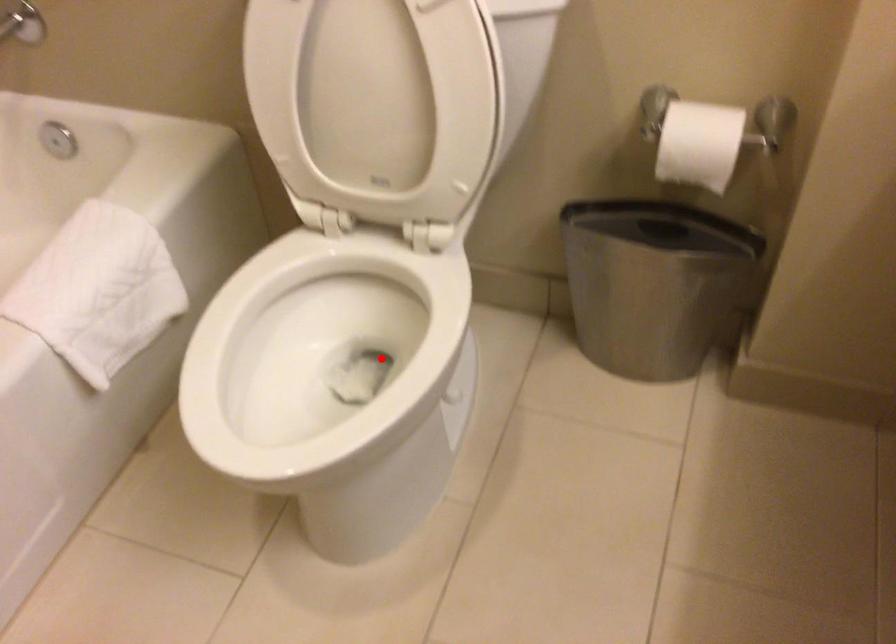
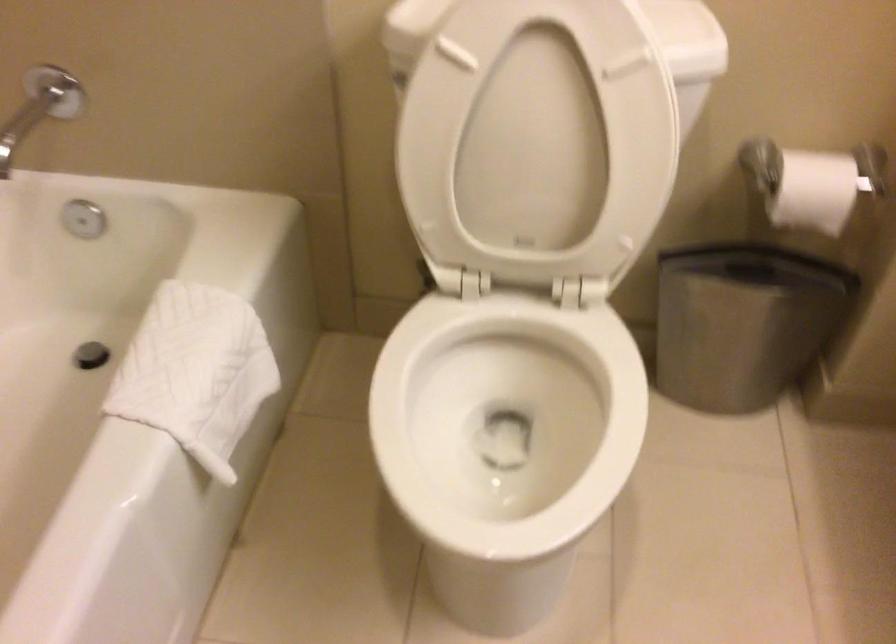
In the second image, find the point that corresponds to the highlighted location in the first image.

(505, 420)